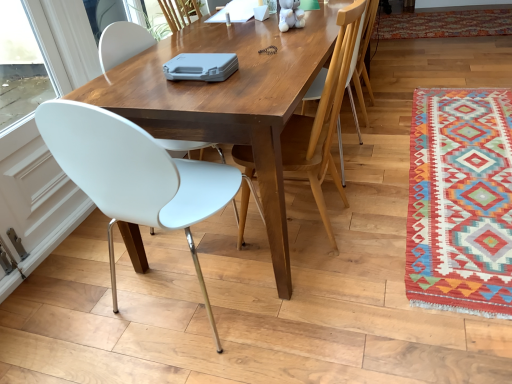
This screenshot has width=512, height=384. What are the coordinates of `vacant space to the right of white plastic chair at left, which is the 3th chair in right-to-left order` in the screenshot? It's located at (311, 305).